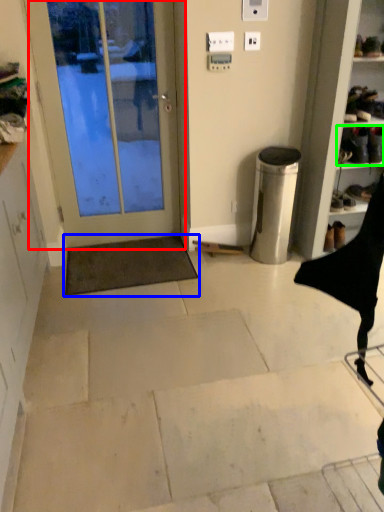
Question: Which object is positioned closest to door (highlighted by a red box)? Select from doormat (highlighted by a blue box) and footwear (highlighted by a green box).

Choices:
 (A) doormat
 (B) footwear

Answer: (A)